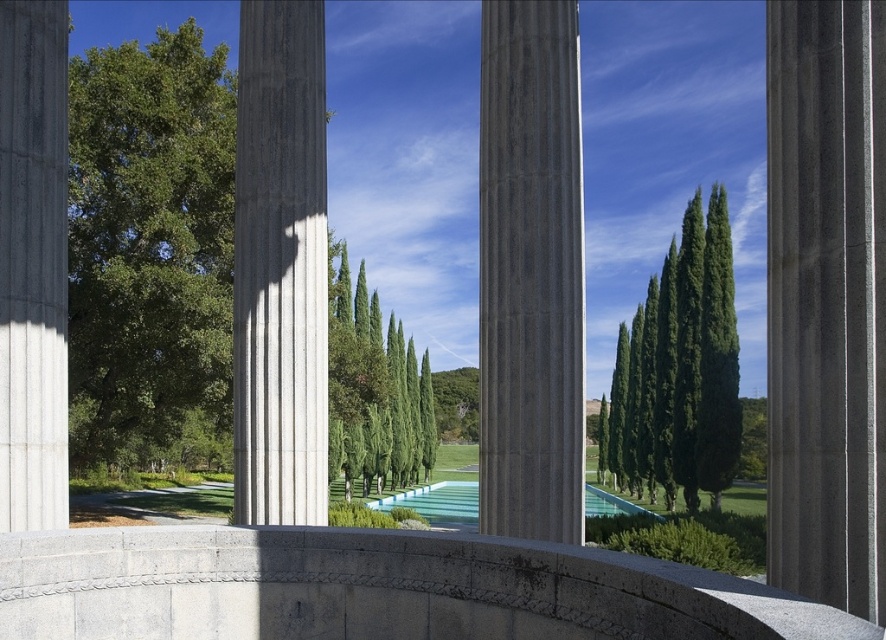
Does smooth concrete column at left have a lesser width compared to clear glass pool at center?

Yes.

Does point (64, 404) come behind point (471, 486)?

That is False.

This screenshot has height=640, width=886. What are the coordinates of `smooth concrete column at left` in the screenshot? It's located at (33, 264).

Is point (807, 156) closer to camera compared to point (232, 522)?

Yes.

Can you confirm if smooth concrete pillar at right is positioned above smooth concrete column at center?

Correct, smooth concrete pillar at right is located above smooth concrete column at center.

Does point (795, 467) come in front of point (286, 417)?

Yes.

Where is `smooth concrete pillar at right`? This screenshot has width=886, height=640. smooth concrete pillar at right is located at coordinates (826, 300).

Locate an element on the screen. smooth concrete pillar at right is located at coordinates (826, 300).

Does point (867, 147) come farther from viewer compared to point (697, 276)?

No, it is in front of (697, 276).

This screenshot has width=886, height=640. I want to click on smooth concrete pillar at right, so click(826, 300).